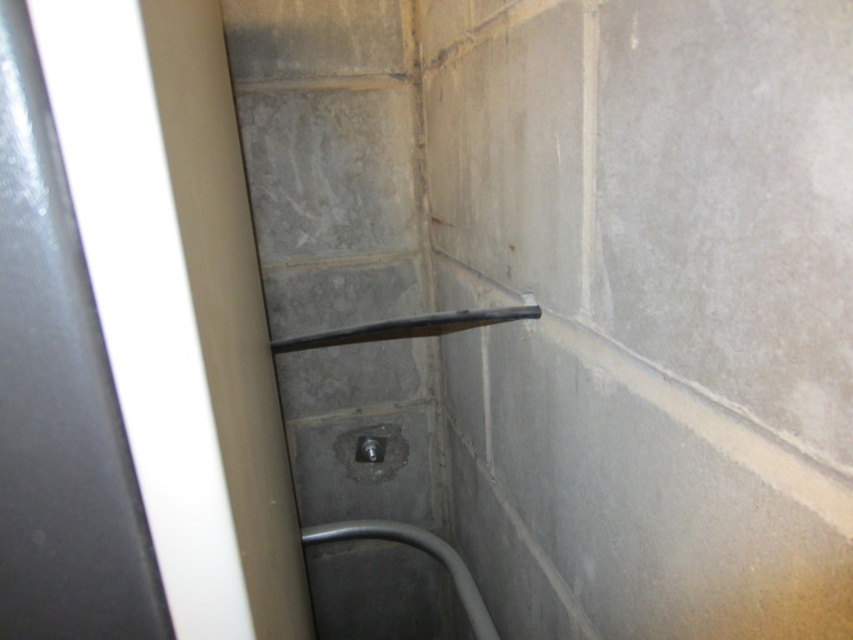
You are a plumber installing a new shower and drain in this utility room. The black rubber shower at center and the satin silver drain at center must be positioned precisely. Given their sizes, which one requires more horizontal space to install?

The black rubber shower at center requires more horizontal space to install because its width surpasses that of the satin silver drain at center.

You are installing a new fixture and need to know the exact position of the black rubber shower at center. What are its coordinates?

The black rubber shower at center is located at point (409, 326).

You are standing in the utility room and need to reach both the black rubber shower at center and the satin silver drain at center. Which object is closer to you?

The black rubber shower at center is closer to the viewer than the satin silver drain at center.